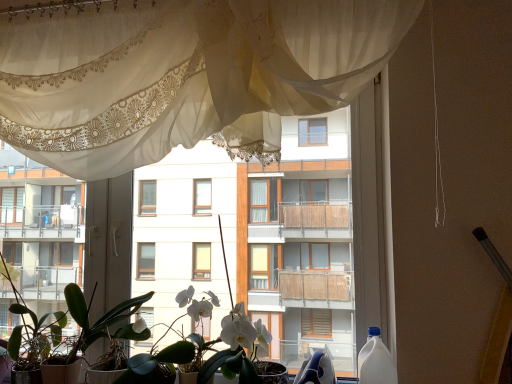
Question: Is green matte plant at lower left touching white plastic bottle at right?

Choices:
 (A) no
 (B) yes

Answer: (A)

Question: Is green matte plant at lower left positioned before white plastic bottle at right?

Choices:
 (A) yes
 (B) no

Answer: (B)

Question: Is green matte plant at lower left completely or partially outside of white plastic bottle at right?

Choices:
 (A) no
 (B) yes

Answer: (B)

Question: Can you confirm if green matte plant at lower left is shorter than white plastic bottle at right?

Choices:
 (A) no
 (B) yes

Answer: (A)

Question: From a real-world perspective, is green matte plant at lower left located higher than white plastic bottle at right?

Choices:
 (A) yes
 (B) no

Answer: (A)

Question: From the image's perspective, is green matte plant at lower left on top of white plastic bottle at right?

Choices:
 (A) no
 (B) yes

Answer: (B)

Question: Does white matte orchid at center lie behind green matte plant at lower left?

Choices:
 (A) yes
 (B) no

Answer: (B)

Question: Is white matte orchid at center to the right of green matte plant at lower left from the viewer's perspective?

Choices:
 (A) yes
 (B) no

Answer: (A)

Question: Considering the relative sizes of white matte orchid at center and green matte plant at lower left in the image provided, is white matte orchid at center smaller than green matte plant at lower left?

Choices:
 (A) yes
 (B) no

Answer: (A)

Question: Is the position of white matte orchid at center less distant than that of green matte plant at lower left?

Choices:
 (A) yes
 (B) no

Answer: (A)

Question: From the image's perspective, is white matte orchid at center located beneath green matte plant at lower left?

Choices:
 (A) yes
 (B) no

Answer: (B)

Question: Is white matte orchid at center not inside green matte plant at lower left?

Choices:
 (A) yes
 (B) no

Answer: (A)

Question: Does white glossy balcony at left appear on the left side of white matte orchid at center?

Choices:
 (A) yes
 (B) no

Answer: (A)